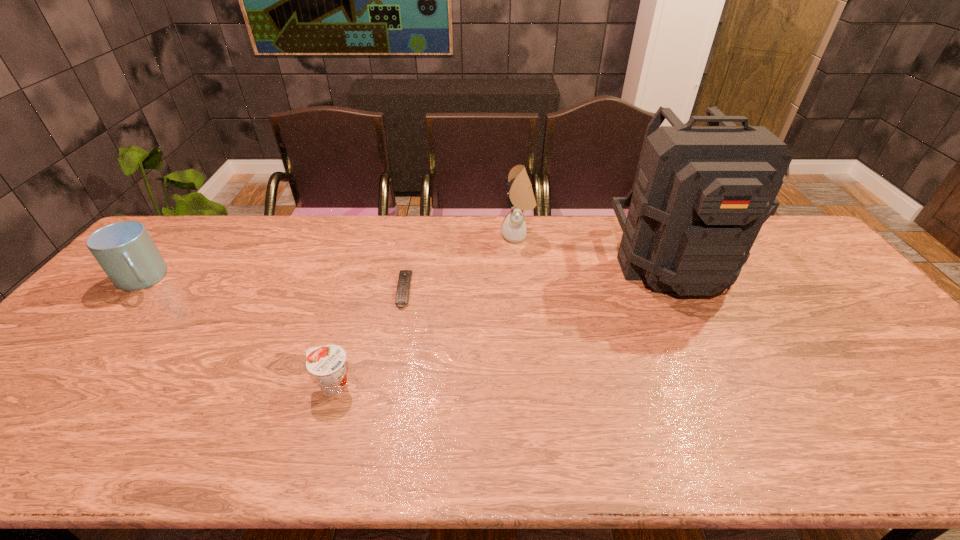
Image resolution: width=960 pixels, height=540 pixels. In the image, there is a desktop. In order to click on vacant region at the far edge in this screenshot , I will do (309, 238).

This screenshot has height=540, width=960. I want to click on vacant space at the near edge of the desktop, so click(x=247, y=437).

In the image, there is a desktop. Where is `free region at the left edge`? free region at the left edge is located at coordinates (51, 358).

In the image, there is a desktop. Where is `vacant space at the right edge`? The image size is (960, 540). vacant space at the right edge is located at coordinates (896, 383).

Where is `vacant region at the far right corner of the desktop`? vacant region at the far right corner of the desktop is located at coordinates (777, 218).

Identify the location of vacant area that lies between the yogurt and the fourth object from left to right. The image size is (960, 540). (425, 310).

At what (x,y) coordinates should I click in order to perform the action: click on free space between the second shortest object and the fourth shortest object. Please return your answer as a coordinate pair (x, y). This screenshot has height=540, width=960. Looking at the image, I should click on (425, 310).

Image resolution: width=960 pixels, height=540 pixels. What are the coordinates of `free space between the remote control and the fourth object from left to right` in the screenshot? It's located at (461, 263).

Image resolution: width=960 pixels, height=540 pixels. What are the coordinates of `vacant area that lies between the third object from left to right and the nearest object` in the screenshot? It's located at (369, 338).

Find the location of a particular element. The height and width of the screenshot is (540, 960). vacant space in between the fourth object from left to right and the leftmost object is located at coordinates (330, 258).